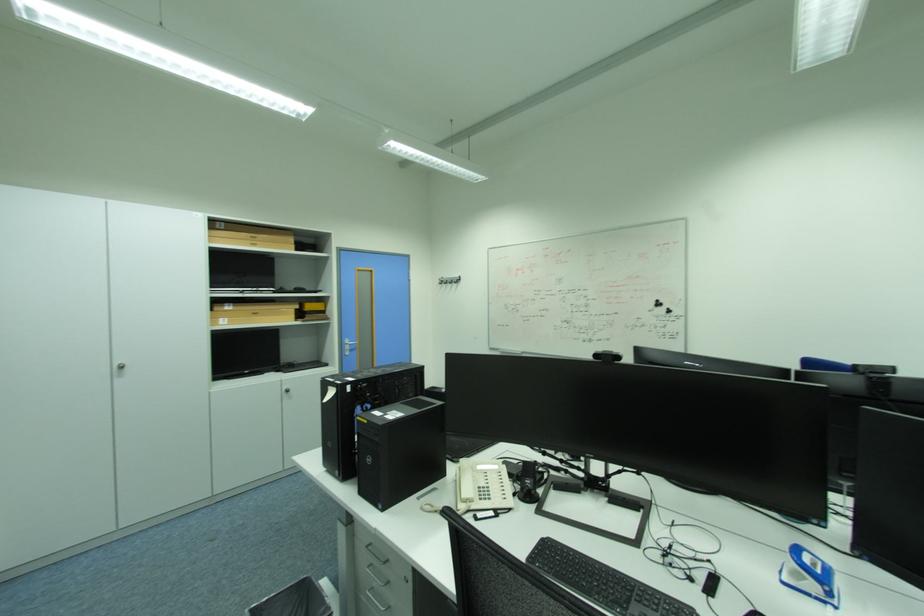
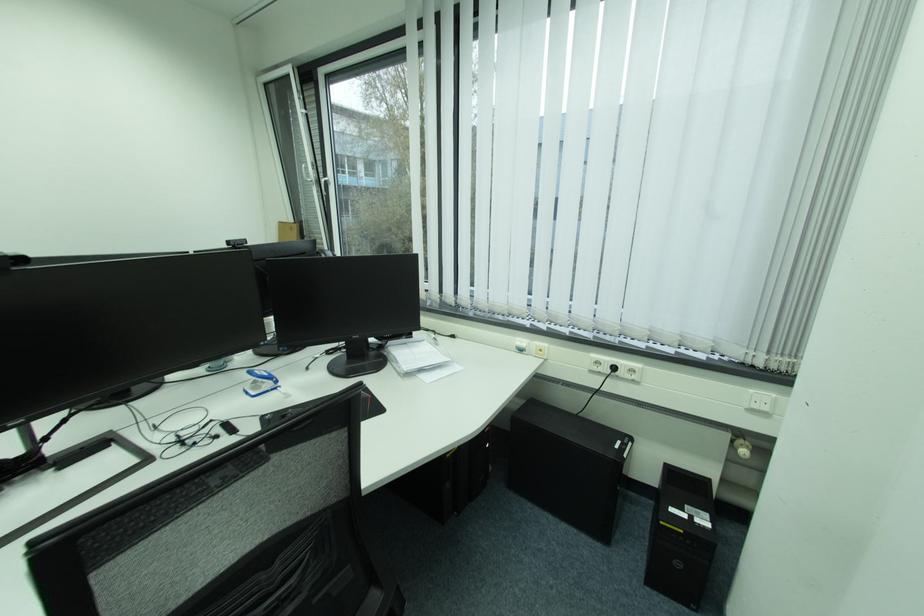
The point at (626, 359) is marked in the first image. Where is the corresponding point in the second image?

(29, 261)